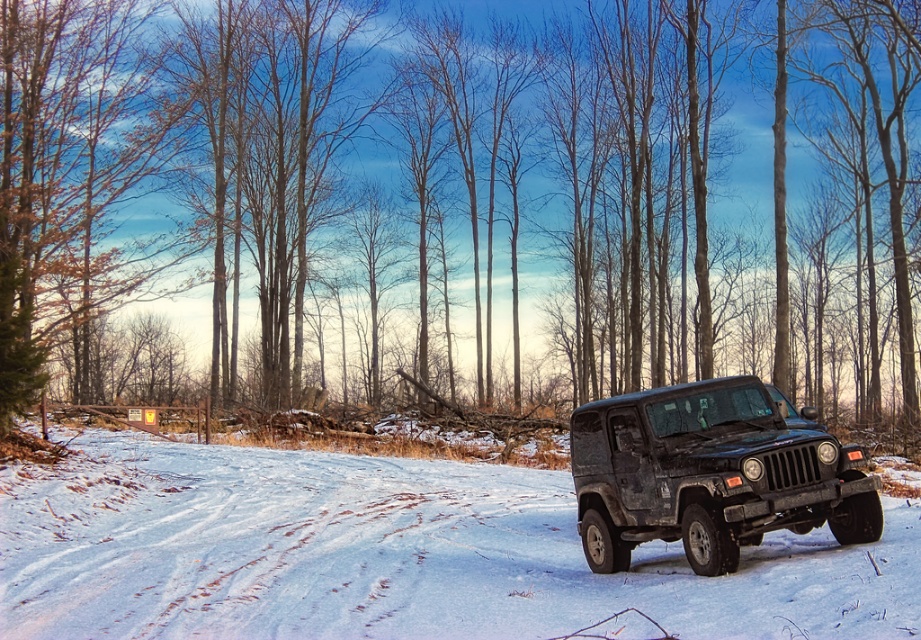
Question: Is smooth bark tree at center wider than white powdery snow at center?

Choices:
 (A) yes
 (B) no

Answer: (A)

Question: Is smooth bark tree at center bigger than white powdery snow at center?

Choices:
 (A) no
 (B) yes

Answer: (B)

Question: Which of the following is the farthest from the observer?

Choices:
 (A) smooth bark tree at center
 (B) white powdery snow at center
 (C) matte black jeep at center

Answer: (A)

Question: In this image, where is smooth bark tree at center located relative to white powdery snow at center?

Choices:
 (A) left
 (B) right

Answer: (B)

Question: Which point is closer to the camera?

Choices:
 (A) (592, 570)
 (B) (853, 554)
 (C) (589, 54)

Answer: (B)

Question: Among these points, which one is farthest from the camera?

Choices:
 (A) (917, 396)
 (B) (146, 561)
 (C) (741, 449)

Answer: (A)